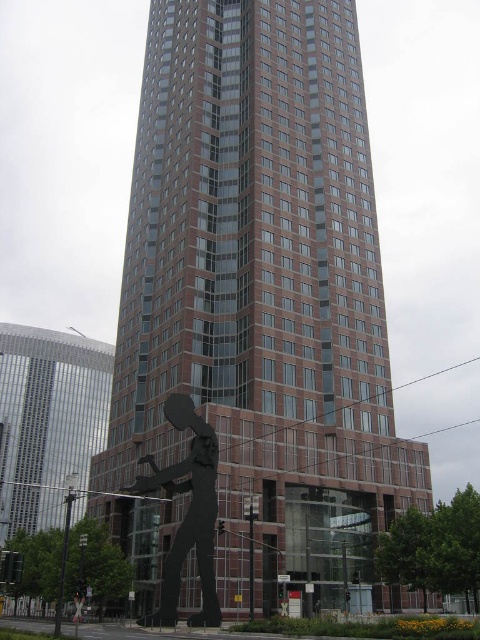
You are an architect evaluating the urban space. The brown brick building at center and the black matte sculpture at lower center are both part of the design. Based on their sizes, which one would dominate the visual focus of the scene?

The brown brick building at center has a larger size compared to the black matte sculpture at lower center, so it would dominate the visual focus of the scene.

You are an architect examining the urban landscape. You notice the brown brick building at center and the black matte sculpture at lower center. Which object is closer to your current position?

The black matte sculpture at lower center is closer to you because the brown brick building at center is further away.